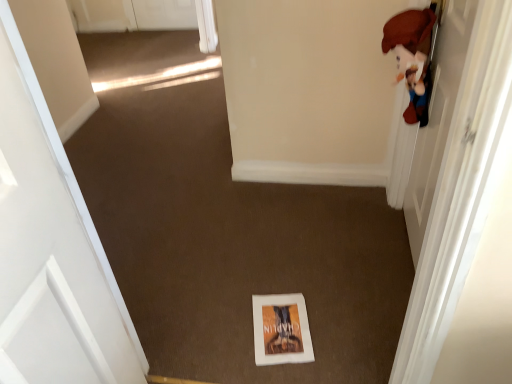
Locate an element on the screen. The width and height of the screenshot is (512, 384). vacant space underneath white paper book at center (from a real-world perspective) is located at coordinates pyautogui.click(x=285, y=328).